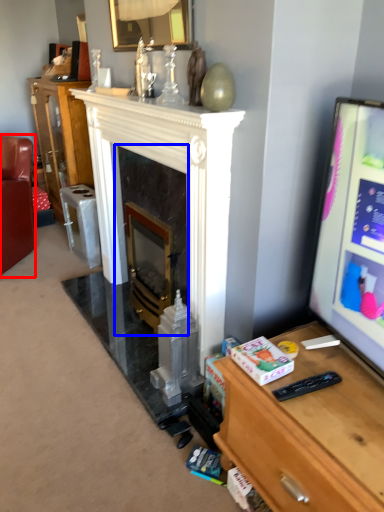
Question: Which point is further to the camera, furniture (highlighted by a red box) or fireplace (highlighted by a blue box)?

Choices:
 (A) furniture
 (B) fireplace

Answer: (A)